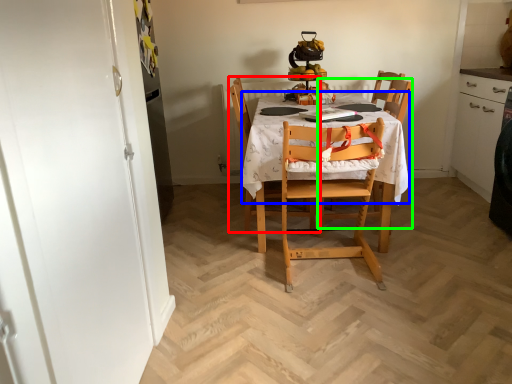
Question: Estimate the real-world distances between objects in this image. Which object is closer to chair (highlighted by a red box), tablecloth (highlighted by a blue box) or chair (highlighted by a green box)?

Choices:
 (A) tablecloth
 (B) chair

Answer: (A)